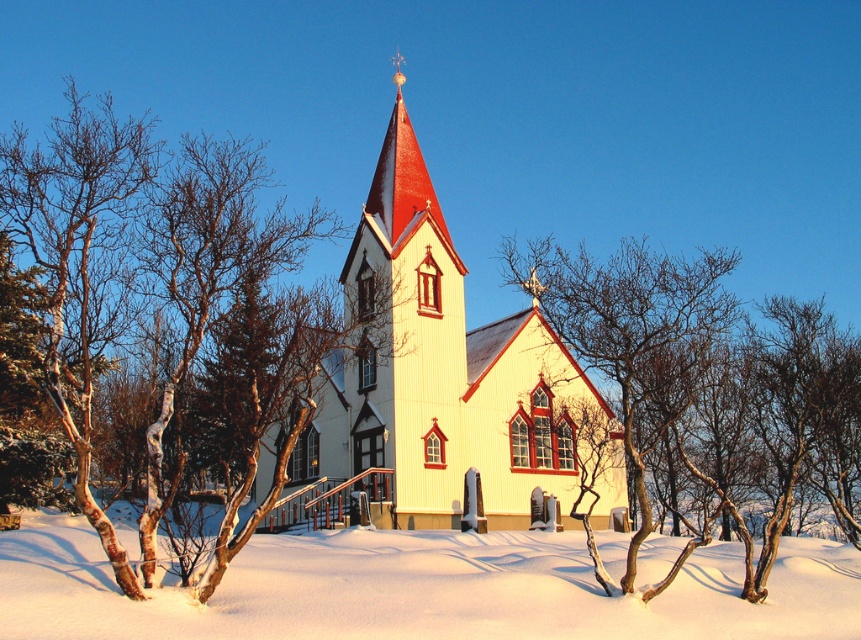
Is white bark tree at center bigger than white wood church at center?

Yes.

Is white bark tree at center taller than white wood church at center?

Incorrect, white bark tree at center's height is not larger of white wood church at center's.

Who is more distant from viewer, (208,304) or (485,435)?

Positioned behind is point (485,435).

At what (x,y) coordinates should I click in order to perform the action: click on white bark tree at center. Please return your answer as a coordinate pair (x, y). The image size is (861, 640). Looking at the image, I should click on (171, 321).

Is white bark tree at center positioned in front of bare branches at center?

Yes, white bark tree at center is closer to the viewer.

Which is behind, point (251, 250) or point (841, 452)?

Point (841, 452)

Which is in front, point (282, 355) or point (722, 404)?

Point (282, 355) is more forward.

Find the location of a particular element. The width and height of the screenshot is (861, 640). white bark tree at center is located at coordinates (171, 321).

Which is above, white bark tree at center or white powdery snow at center?

white bark tree at center

Can you confirm if white bark tree at center is positioned to the left of white powdery snow at center?

Indeed, white bark tree at center is positioned on the left side of white powdery snow at center.

Between point (94, 432) and point (573, 596), which one is positioned in front?

Point (573, 596) is more forward.

The height and width of the screenshot is (640, 861). I want to click on white bark tree at center, so click(x=171, y=321).